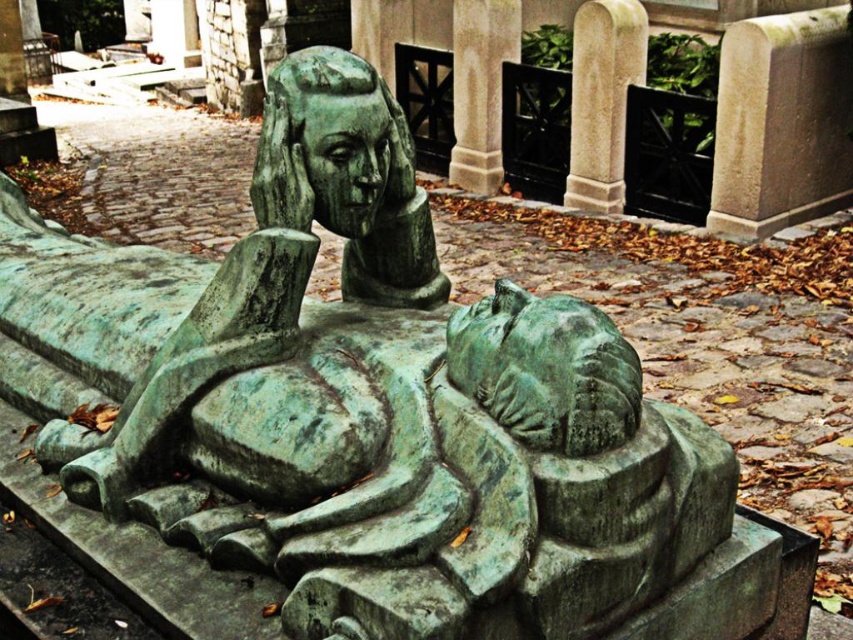
Question: Estimate the real-world distances between objects in this image. Which object is closer to the smooth stone pillar at upper center?

Choices:
 (A) green patina bust at center
 (B) smooth stone pillar at center

Answer: (B)

Question: Can you confirm if smooth stone pillar at center is positioned to the right of smooth stone pillar at upper center?

Choices:
 (A) yes
 (B) no

Answer: (A)

Question: Is green patina bust at center smaller than smooth stone pillar at upper center?

Choices:
 (A) no
 (B) yes

Answer: (B)

Question: Which is farther from the smooth stone pillar at upper center?

Choices:
 (A) green patina bust at center
 (B) smooth stone pillar at center

Answer: (A)

Question: Which object appears farthest from the camera in this image?

Choices:
 (A) smooth stone pillar at center
 (B) smooth stone pillar at upper center
 (C) green patina bust at center

Answer: (B)

Question: Is green patina bust at center above smooth stone pillar at center?

Choices:
 (A) yes
 (B) no

Answer: (B)